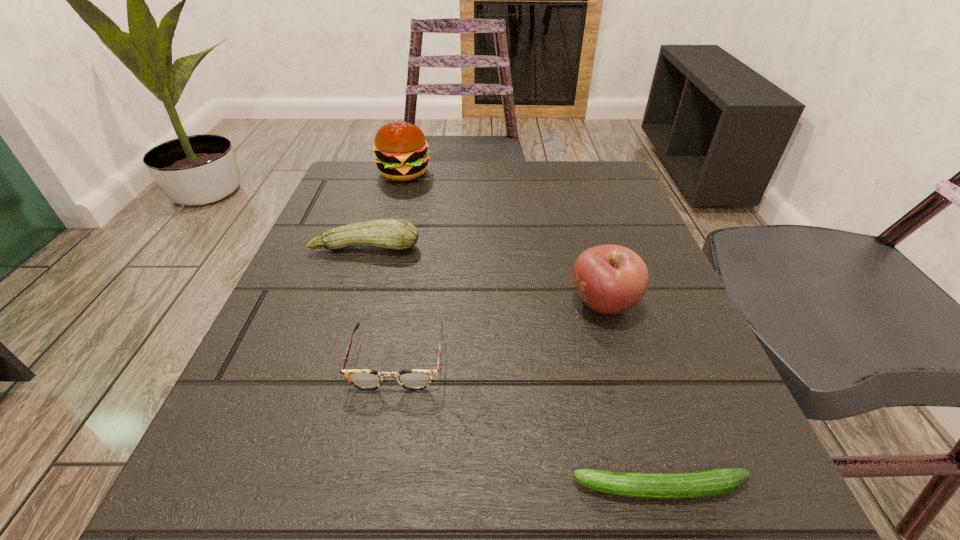
Locate an element on the screen. The height and width of the screenshot is (540, 960). the farthest object is located at coordinates (401, 152).

You are a GUI agent. You are given a task and a screenshot of the screen. Output one action in this format:
    pyautogui.click(x=<x>, y=<y>)
    Task: Click on the hamburger
    
    Given the screenshot: What is the action you would take?
    pyautogui.click(x=401, y=152)

You are a GUI agent. You are given a task and a screenshot of the screen. Output one action in this format:
    pyautogui.click(x=<x>, y=<y>)
    Task: Click on the third farthest object
    
    Given the screenshot: What is the action you would take?
    pyautogui.click(x=610, y=279)

The height and width of the screenshot is (540, 960). Find the location of `the fourth shortest object`. the fourth shortest object is located at coordinates (610, 279).

Where is `the taller zucchini`? This screenshot has height=540, width=960. the taller zucchini is located at coordinates (391, 233).

The image size is (960, 540). I want to click on the left zucchini, so point(391,233).

Find the location of a particular element. the second shortest object is located at coordinates (412, 379).

Find the location of a particular element. spectacles is located at coordinates (412, 379).

I want to click on the right zucchini, so click(712, 482).

The image size is (960, 540). In order to click on the nearer zucchini in this screenshot , I will do `click(712, 482)`.